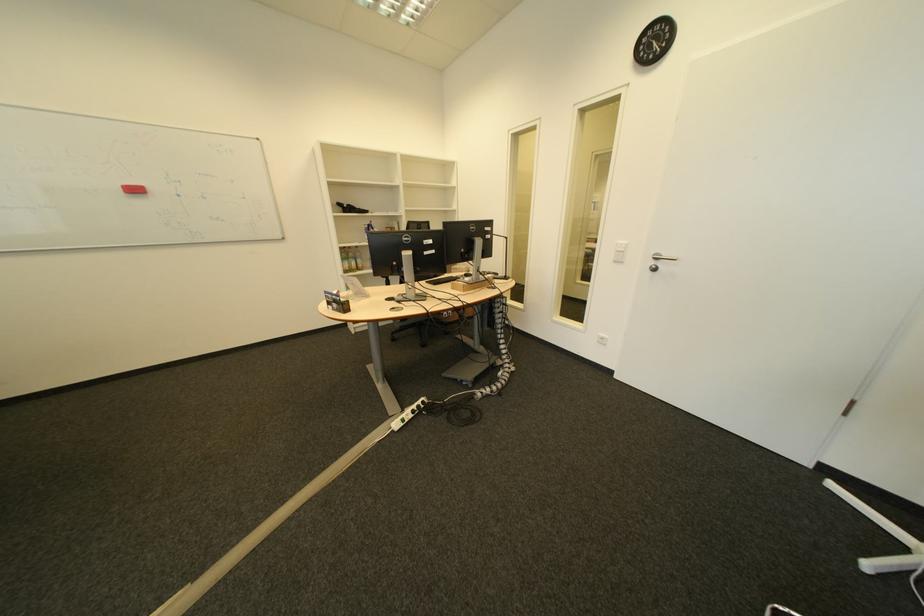
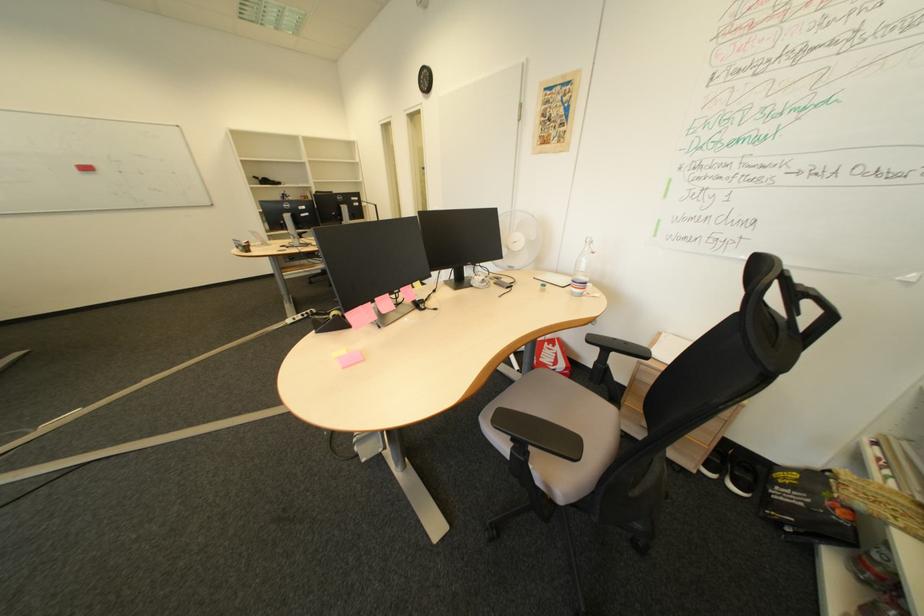
What movement of the cameraman would produce the second image?

The cameraman moved toward right, backward.